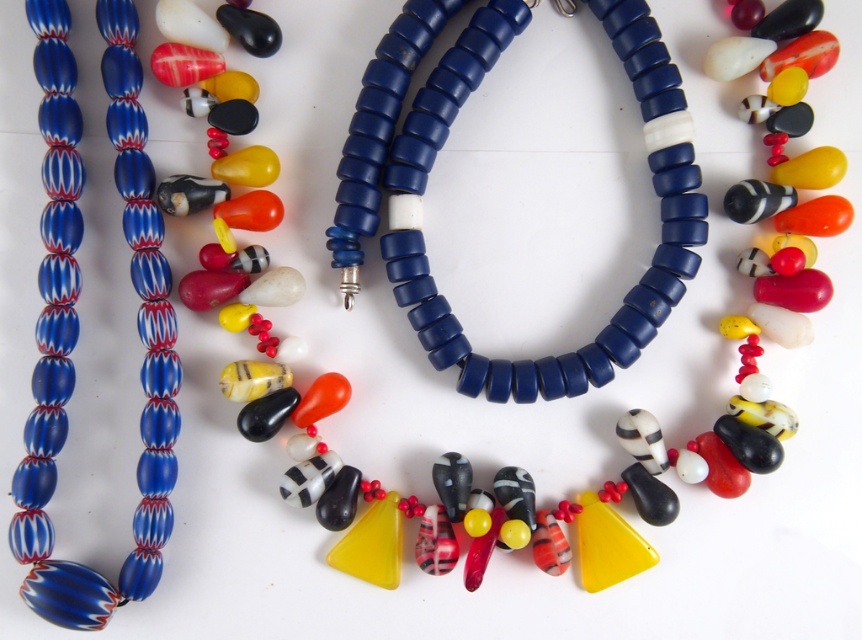
Is blue matte beads at center taller than blue marbled beads at left?

No.

Is blue matte beads at center positioned before blue marbled beads at left?

No, it is not.

Between point (448, 77) and point (130, 38), which one is positioned in front?

Positioned in front is point (130, 38).

Locate an element on the screen. Image resolution: width=862 pixels, height=640 pixels. blue matte beads at center is located at coordinates (428, 260).